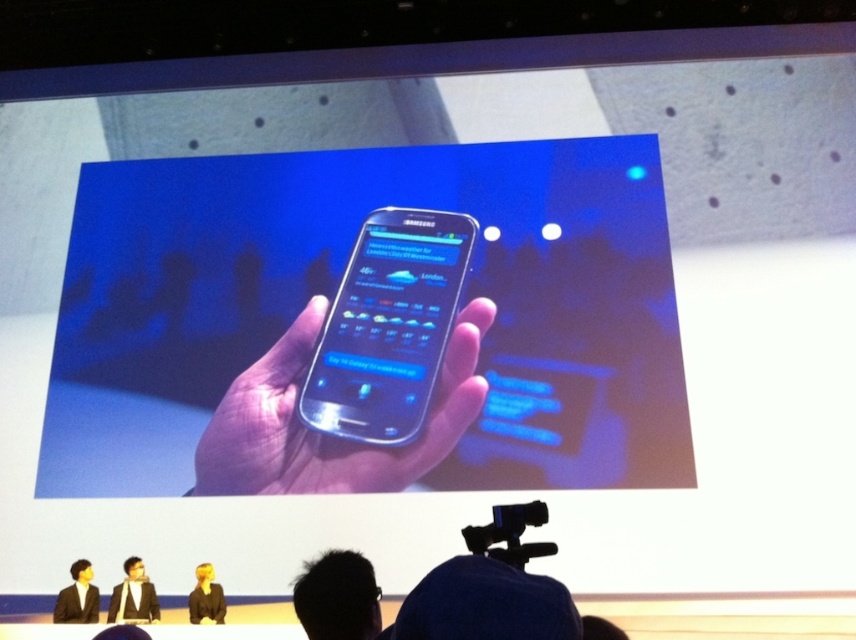
You are a photographer at the event and need to capture a closeup of both the metallic silver phone at center and the transparent plastic phone at center. The camera you are using has a minimum focusing distance of 4 feet. Can you take a clear photo of both phones without moving the camera?

The metallic silver phone at center is 3.93 feet away from the transparent plastic phone at center. Since the minimum focusing distance is 4 feet, the camera cannot focus on both phones as they are closer than the required distance.

You are a photographer adjusting the focus of your camera. You notice two points on the slide projection at coordinates point (438, 458) and point (88, 577). Which point is closer to the camera lens so that you can focus on it first?

Point (88, 577) is closer to the camera lens than point (438, 458), so you should focus on point (88, 577) first.

You are a photographer at the event and need to capture a closeup of the presenter in the black suit at center without moving your position. The camera you have is a black plastic video camera at lower center. Can you adjust the zoom to focus on the presenter clearly?

The black plastic video camera at lower center is 15.30 feet away from the black suit at center. Since most professional cameras can zoom effectively at this distance, you should be able to adjust the zoom to focus on the presenter in the black suit at center clearly.